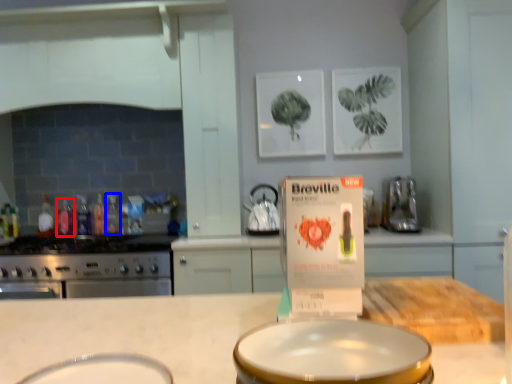
Question: Among these objects, which one is farthest to the camera, bottle (highlighted by a red box) or bottle (highlighted by a blue box)?

Choices:
 (A) bottle
 (B) bottle

Answer: (A)